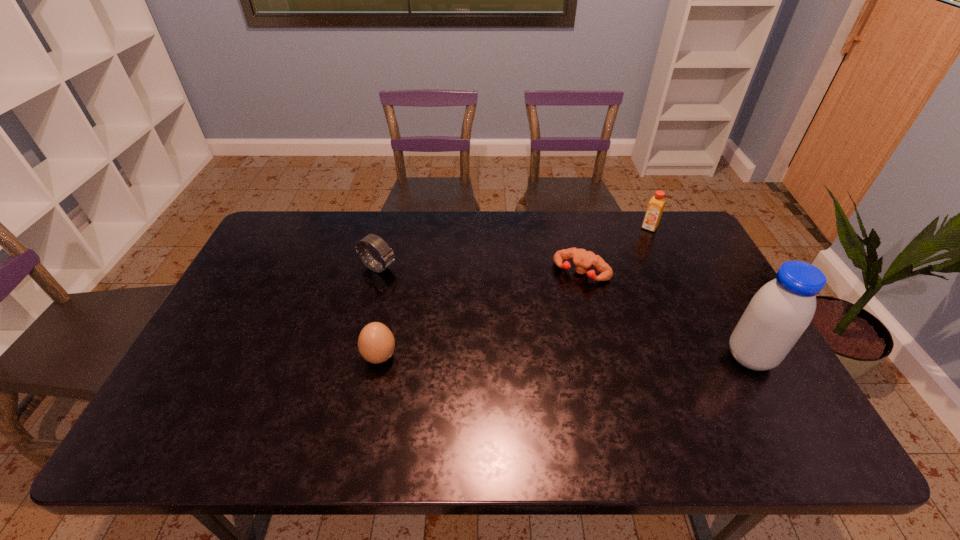
The height and width of the screenshot is (540, 960). What are the coordinates of `vacant space situated 0.220m with the gloves of the puncher facing forward` in the screenshot? It's located at (542, 334).

This screenshot has width=960, height=540. In order to click on free spot located 0.120m with the gloves of the puncher facing forward in this screenshot , I will do `click(556, 310)`.

Locate an element on the screen. The height and width of the screenshot is (540, 960). vacant region located 0.340m with the gloves of the puncher facing forward is located at coordinates [523, 366].

Where is `free space located 0.050m on the face of the watch`? The image size is (960, 540). free space located 0.050m on the face of the watch is located at coordinates (406, 280).

The width and height of the screenshot is (960, 540). I want to click on vacant space located on the face of the watch, so click(497, 321).

Identify the location of free region located on the face of the watch. (469, 309).

I want to click on free region located 0.050m on the front and back of the farthest object, so click(643, 240).

Where is `free space located 0.130m on the front and back of the farthest object`? free space located 0.130m on the front and back of the farthest object is located at coordinates (636, 253).

The height and width of the screenshot is (540, 960). In order to click on free space located 0.300m on the front and back of the farthest object in this screenshot , I will do `click(619, 284)`.

Locate an element on the screen. The width and height of the screenshot is (960, 540). object that is at the far edge is located at coordinates (656, 205).